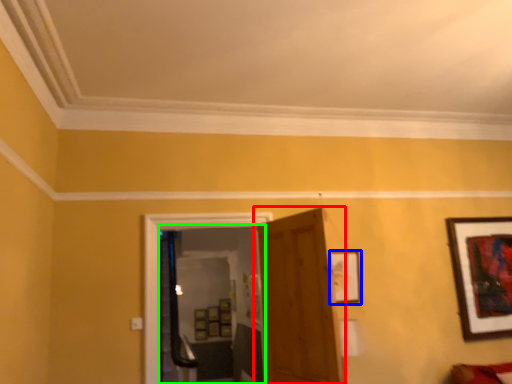
Question: Which is nearer to the door (highlighted by a red box)? picture frame (highlighted by a blue box) or glass door (highlighted by a green box).

Choices:
 (A) picture frame
 (B) glass door

Answer: (A)